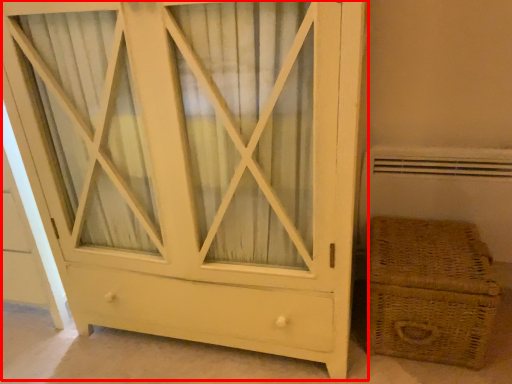
Question: From the image's perspective, what is the correct spatial positioning of chest of drawers (annotated by the red box) in reference to basket?

Choices:
 (A) above
 (B) below

Answer: (A)